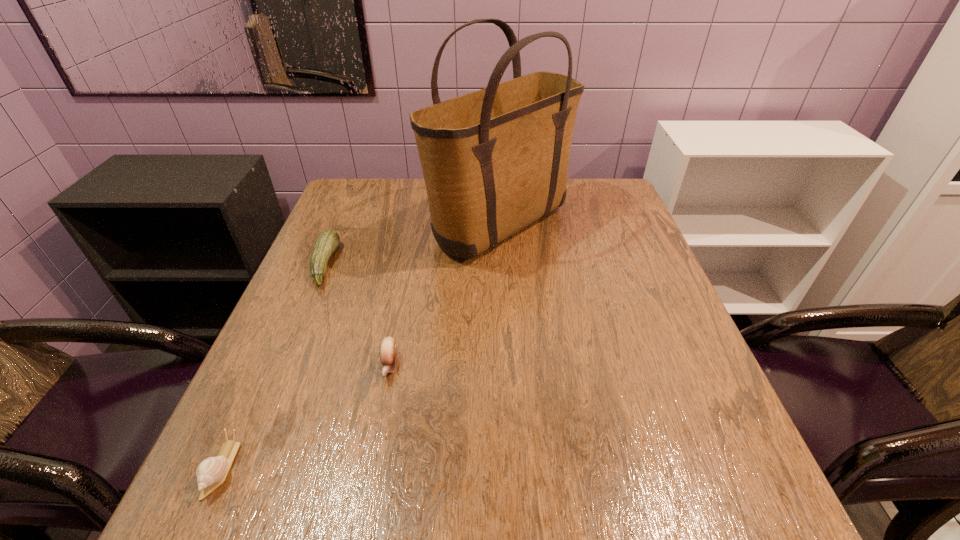
This screenshot has width=960, height=540. I want to click on free space between the right escargot and the left escargot, so click(x=305, y=417).

At what (x,y) coordinates should I click in order to perform the action: click on empty space between the zucchini and the shortest object. Please return your answer as a coordinate pair (x, y). Image resolution: width=960 pixels, height=540 pixels. Looking at the image, I should click on coord(274,366).

The image size is (960, 540). I want to click on object that is the closest to the zucchini, so click(x=495, y=160).

Locate which object ranks second in proximity to the tote bag. Please provide its 2D coordinates. Your answer should be formatted as a tuple, i.e. [(x, y)], where the tuple contains the x and y coordinates of a point satisfying the conditions above.

[(388, 350)]